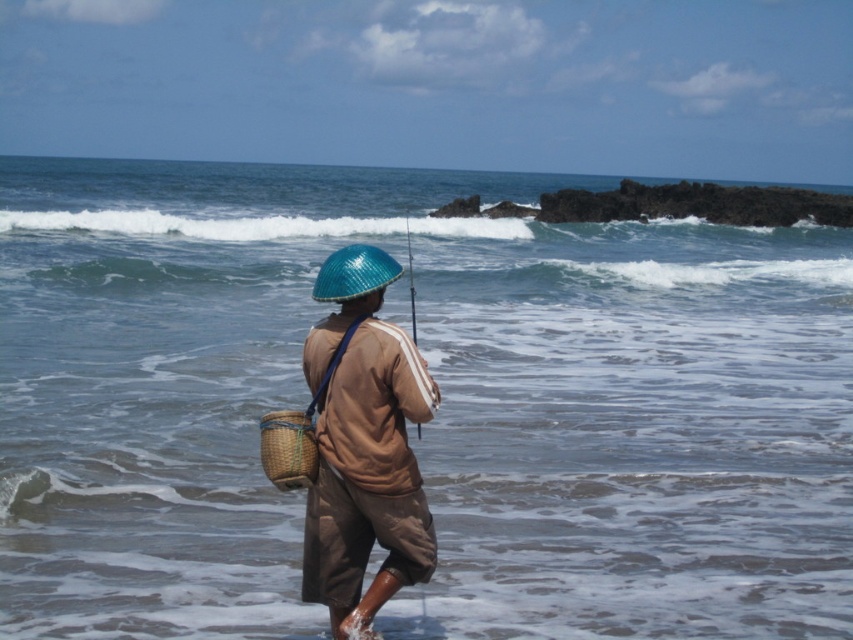
You are a photographer trying to capture the scene of the fisherman with both the brown woven basket at center and the woven brown basket at lower left in the frame. Which basket should you focus on to ensure it appears larger in your photo?

The brown woven basket at center should be focused on because it is closer to the viewer, making it appear larger in the photo compared to the woven brown basket at lower left which is farther away.

You are a hiker who just arrived at the beach and noticed two woven brown baskets in the scene. One is labeled as the brown woven basket at center and the other as the woven brown basket at lower left. According to the image, which basket is positioned to the right of the other?

The brown woven basket at center is to the right of the woven brown basket at lower left.

You are a photographer standing at the shore. You want to take a closeup photo of the brown woven basket at center but your camera can only focus on objects within 15 feet. Can you get a clear photo?

The brown woven basket at center is 18.79 feet from camera, which is beyond the 15 feet focus range. You cannot get a clear photo.